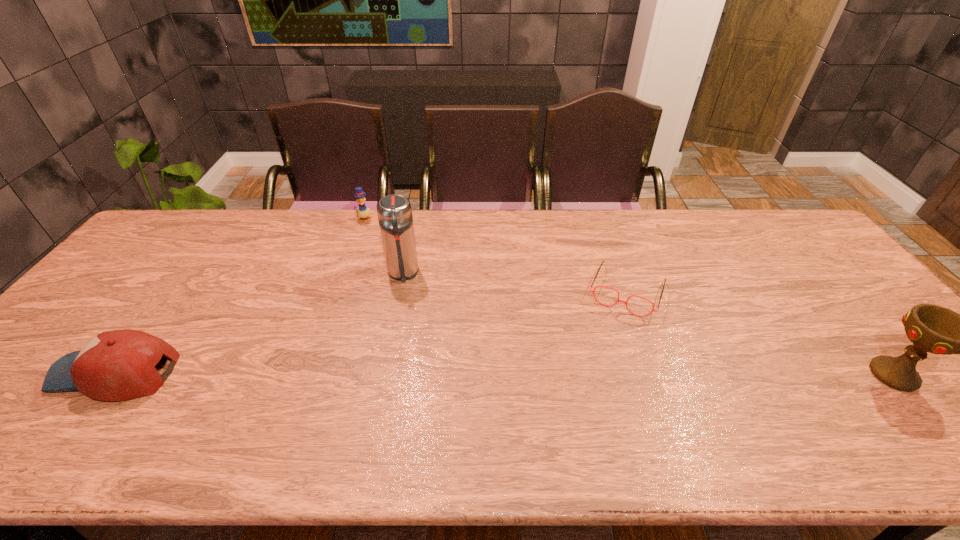
You are a GUI agent. You are given a task and a screenshot of the screen. Output one action in this format:
    pyautogui.click(x=<x>, y=<y>)
    Task: Click on the free space located 0.210m on the face of the fourth object from right to left, where the monocle is placed
    The image size is (960, 540).
    Given the screenshot: What is the action you would take?
    pyautogui.click(x=373, y=260)

The width and height of the screenshot is (960, 540). What are the coordinates of `free point located on the face of the fourth object from right to left, where the monocle is placed` in the screenshot? It's located at (379, 293).

At what (x,y) coordinates should I click in order to perform the action: click on blank space located 0.360m on the face of the fourth object from right to left, where the monocle is placed. Please return your answer as a coordinate pair (x, y). Image resolution: width=960 pixels, height=540 pixels. Looking at the image, I should click on point(379,293).

Where is `blank area located with a handle on the side of the third object from left to right`? The width and height of the screenshot is (960, 540). blank area located with a handle on the side of the third object from left to right is located at coordinates (404, 319).

This screenshot has width=960, height=540. What are the coordinates of `vacant region located with a handle on the side of the third object from left to right` in the screenshot? It's located at (405, 354).

Identify the location of free space located with a handle on the side of the third object from left to right. (407, 385).

Identify the location of free space located on the front-facing side of the spectacles. This screenshot has width=960, height=540. (611, 333).

Locate an element on the screen. vacant space located on the front-facing side of the spectacles is located at coordinates tap(600, 364).

Locate an element on the screen. The image size is (960, 540). free spot located on the front-facing side of the spectacles is located at coordinates (595, 377).

Where is `object that is positioned at the far edge`? The image size is (960, 540). object that is positioned at the far edge is located at coordinates (363, 212).